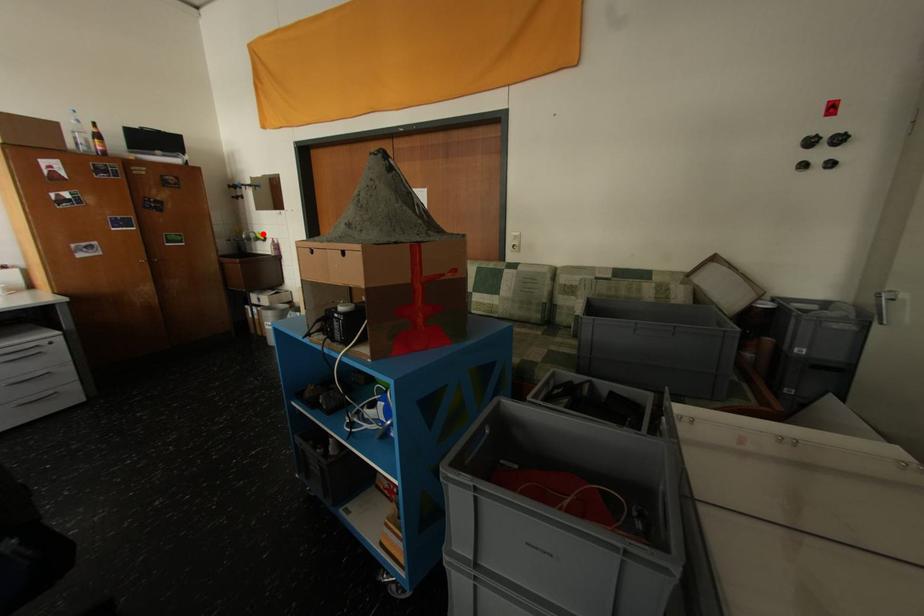
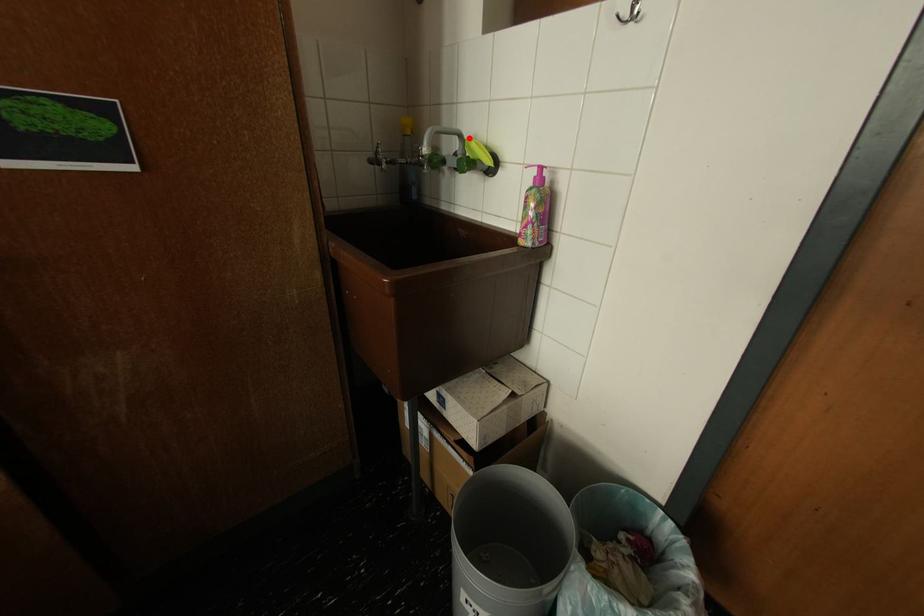
I am providing you with two images of the same scene from different viewpoints. A red point is marked on the first image and another point is marked on the second image. Do the highlighted points in image1 and image2 indicate the same real-world spot?

Yes